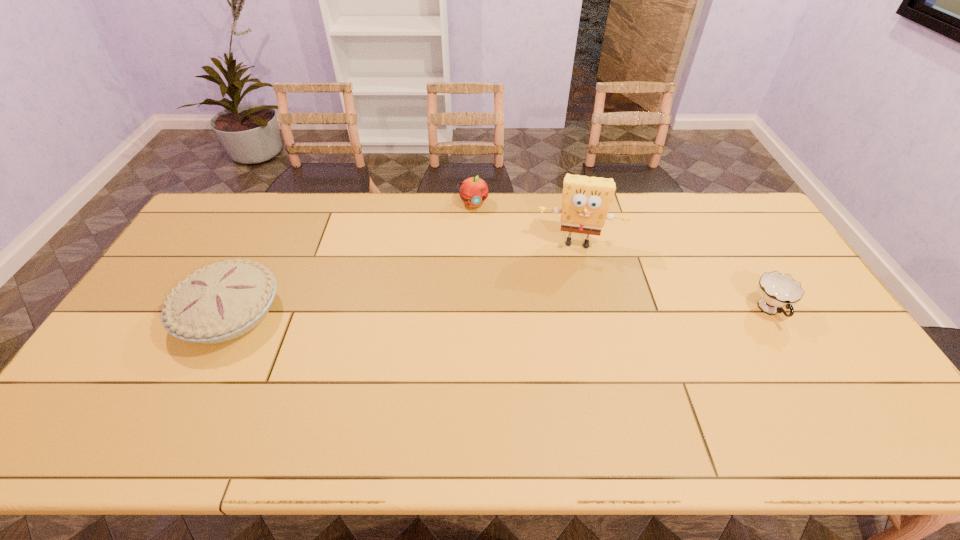
You are a GUI agent. You are given a task and a screenshot of the screen. Output one action in this format:
    pyautogui.click(x=<x>, y=<y>)
    Task: Click on the pie
    
    Given the screenshot: What is the action you would take?
    pyautogui.click(x=225, y=300)

I want to click on the rightmost object, so click(x=776, y=290).

The height and width of the screenshot is (540, 960). I want to click on apple, so click(x=473, y=191).

The height and width of the screenshot is (540, 960). I want to click on the second object from left to right, so click(x=473, y=191).

Find the location of a particular element. The height and width of the screenshot is (540, 960). sponge is located at coordinates (586, 200).

Locate an element on the screen. The image size is (960, 540). the tallest object is located at coordinates (586, 200).

What are the coordinates of `vacant space located 0.090m on the right of the leftmost object` in the screenshot? It's located at (312, 313).

What are the coordinates of `vacant space situated on the side of the rightmost object with the handle` in the screenshot? It's located at (820, 396).

Image resolution: width=960 pixels, height=540 pixels. In order to click on free spot located 0.060m on the surface of the apple in this screenshot , I will do `click(479, 222)`.

Where is `vacant space located on the surface of the apple`? Image resolution: width=960 pixels, height=540 pixels. vacant space located on the surface of the apple is located at coordinates (497, 288).